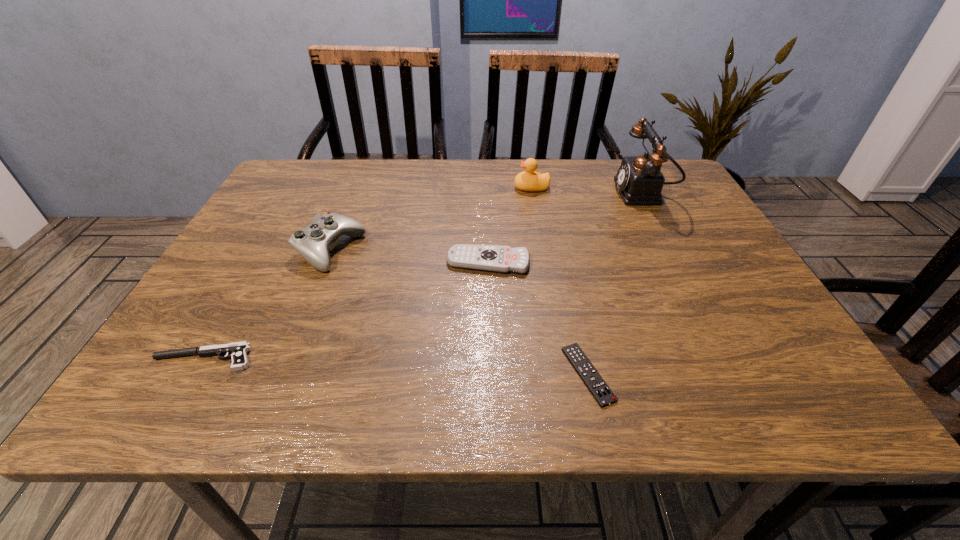
I want to click on free point located 0.320m on the front of the telephone at the rotary dial, so click(x=500, y=193).

Where is `free space located 0.220m on the front of the telephone at the rotary dial`? free space located 0.220m on the front of the telephone at the rotary dial is located at coordinates (536, 193).

Where is `free point located 0.170m on the face of the second tallest object`? This screenshot has width=960, height=540. free point located 0.170m on the face of the second tallest object is located at coordinates click(x=454, y=188).

What are the coordinates of `blank space located 0.050m on the face of the second tallest object` in the screenshot? It's located at (496, 188).

Locate an element on the screen. The height and width of the screenshot is (540, 960). free space located on the face of the second tallest object is located at coordinates (390, 188).

Image resolution: width=960 pixels, height=540 pixels. Find the location of `vacant position located on the back of the control`. vacant position located on the back of the control is located at coordinates (347, 210).

Find the location of a particular element. vacant space situated on the front of the taller remote control is located at coordinates (489, 292).

Where is `free space located 0.170m on the left of the shorter remote control`? The width and height of the screenshot is (960, 540). free space located 0.170m on the left of the shorter remote control is located at coordinates (468, 374).

You are a GUI agent. You are given a task and a screenshot of the screen. Output one action in this format:
    pyautogui.click(x=<x>, y=<y>)
    Task: Click on the telephone that is at the far edge
    Image resolution: width=960 pixels, height=540 pixels.
    Given the screenshot: What is the action you would take?
    pyautogui.click(x=640, y=181)

Find the location of a particular element. This screenshot has height=540, width=960. duck situated at the far edge is located at coordinates (529, 180).